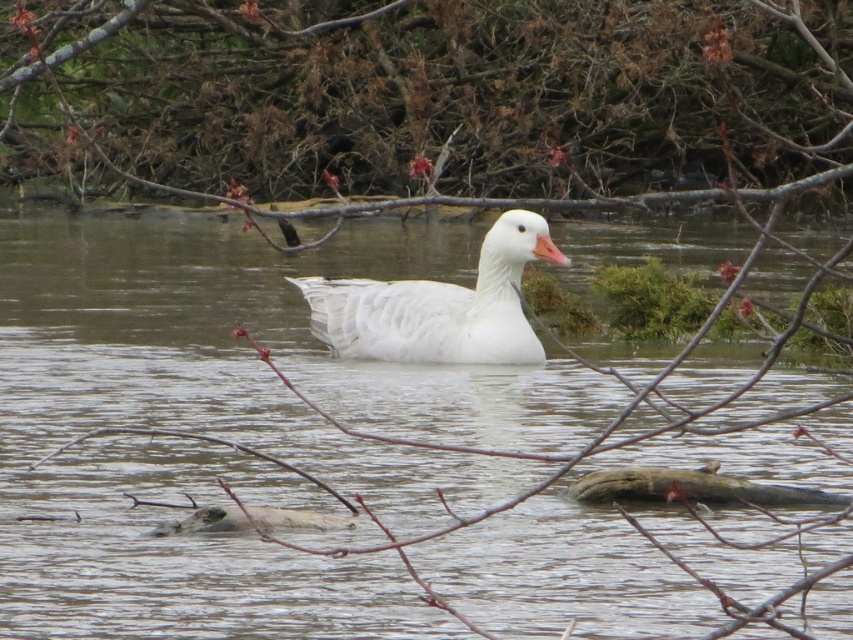
Which of these two, clear water at center or brown rough log at lower center, stands shorter?

Standing shorter between the two is brown rough log at lower center.

How much distance is there between clear water at center and brown rough log at lower center?

clear water at center is 11.11 feet away from brown rough log at lower center.

Which is in front, point (595, 465) or point (756, 492)?

Positioned in front is point (756, 492).

The height and width of the screenshot is (640, 853). Identify the location of clear water at center. (235, 429).

Between white matte duck at center and brown rough log at lower center, which one appears on the right side from the viewer's perspective?

Positioned to the right is brown rough log at lower center.

Does white matte duck at center have a smaller size compared to brown rough log at lower center?

Actually, white matte duck at center might be larger than brown rough log at lower center.

Who is more distant from viewer, (437, 344) or (724, 486)?

Positioned behind is point (437, 344).

I want to click on white matte duck at center, so click(x=438, y=307).

Can you confirm if clear water at center is taller than white matte duck at center?

Yes.

Between point (619, 556) and point (393, 314), which one is positioned behind?

Point (393, 314)

What do you see at coordinates (235, 429) in the screenshot?
I see `clear water at center` at bounding box center [235, 429].

I want to click on clear water at center, so click(235, 429).